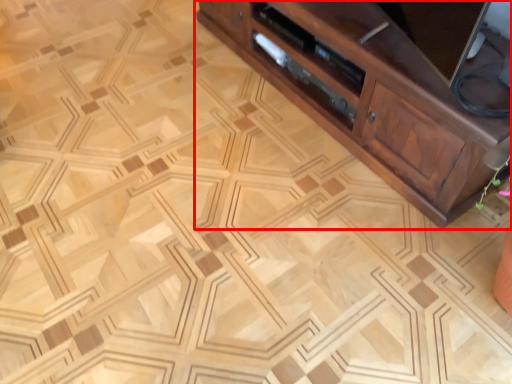
Question: From the image's perspective, what is the correct spatial positioning of cabinetry (annotated by the red box) in reference to drawer?

Choices:
 (A) below
 (B) above

Answer: (B)